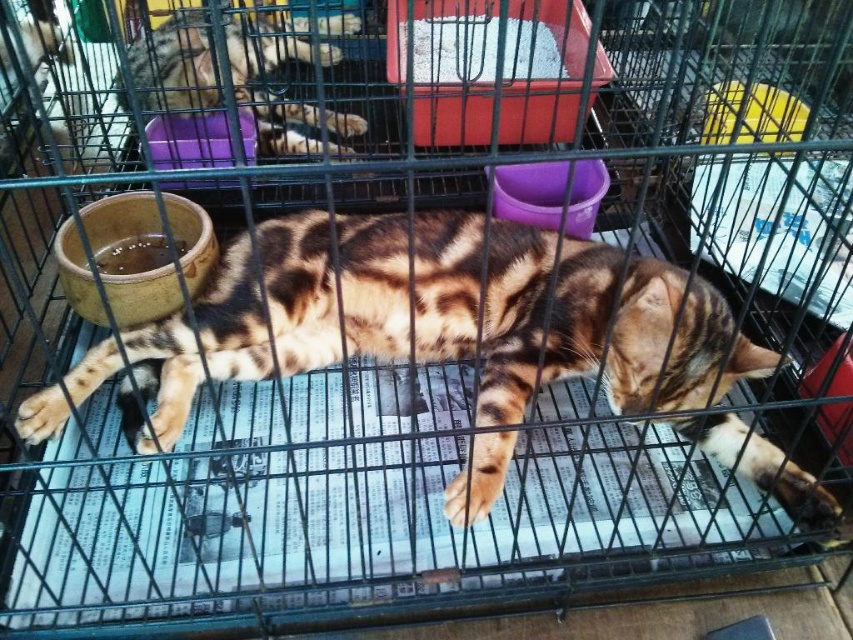
Can you confirm if tabby fur cat at center is thinner than tabby fur cat at upper left?

No.

Is tabby fur cat at center positioned in front of tabby fur cat at upper left?

Yes, it is.

Who is more forward, (572,259) or (241,96)?

Point (572,259) is in front.

You are a GUI agent. You are given a task and a screenshot of the screen. Output one action in this format:
    pyautogui.click(x=<x>, y=<y>)
    Task: Click on the tabby fur cat at center
    Image resolution: width=853 pixels, height=640 pixels.
    Given the screenshot: What is the action you would take?
    pos(421,321)